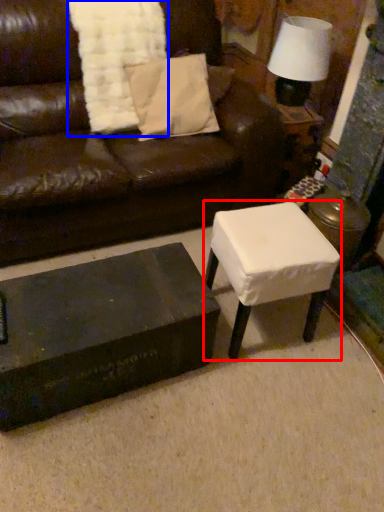
Question: Among these objects, which one is nearest to the camera, table (highlighted by a red box) or blanket (highlighted by a blue box)?

Choices:
 (A) table
 (B) blanket

Answer: (A)